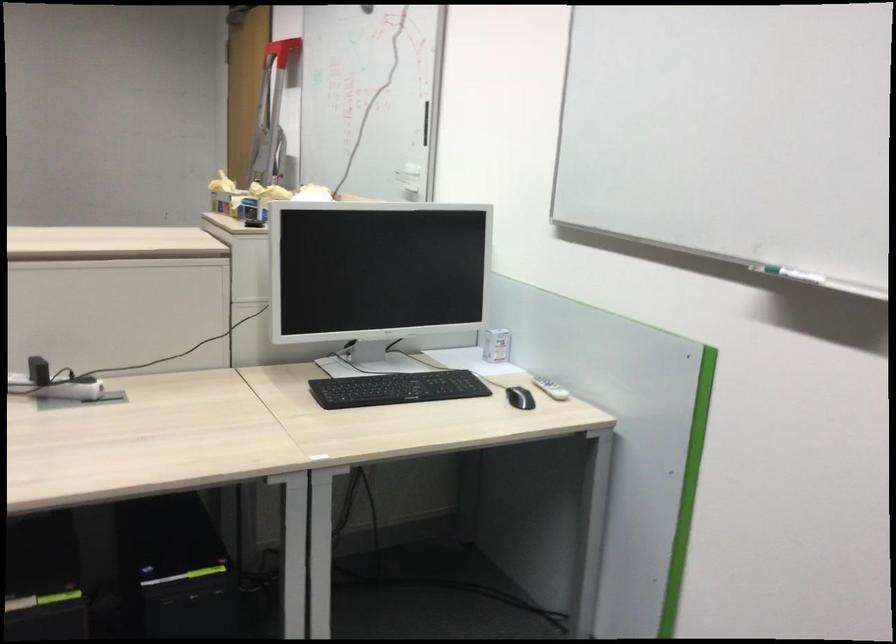
Locate an element on the screen. whiteboard handle is located at coordinates (426, 122).